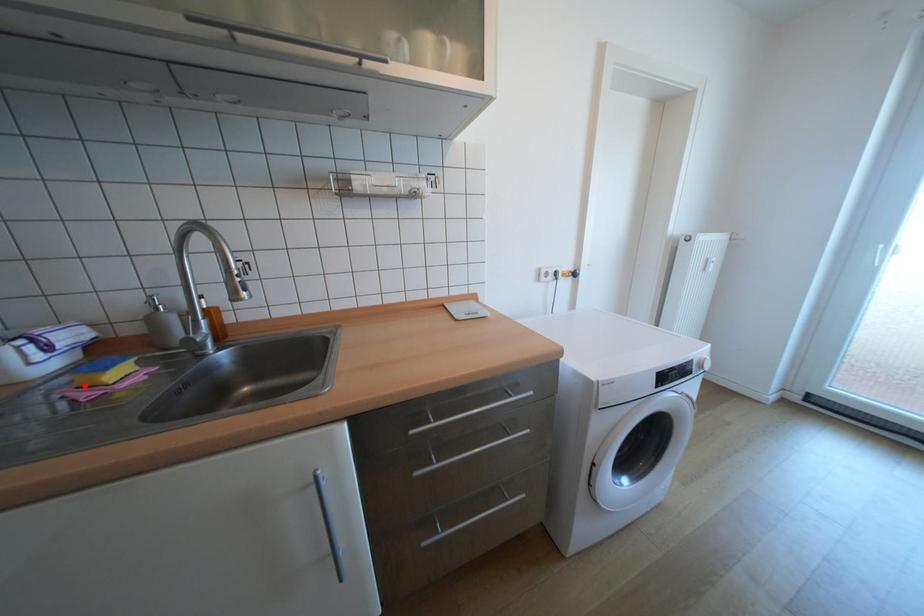
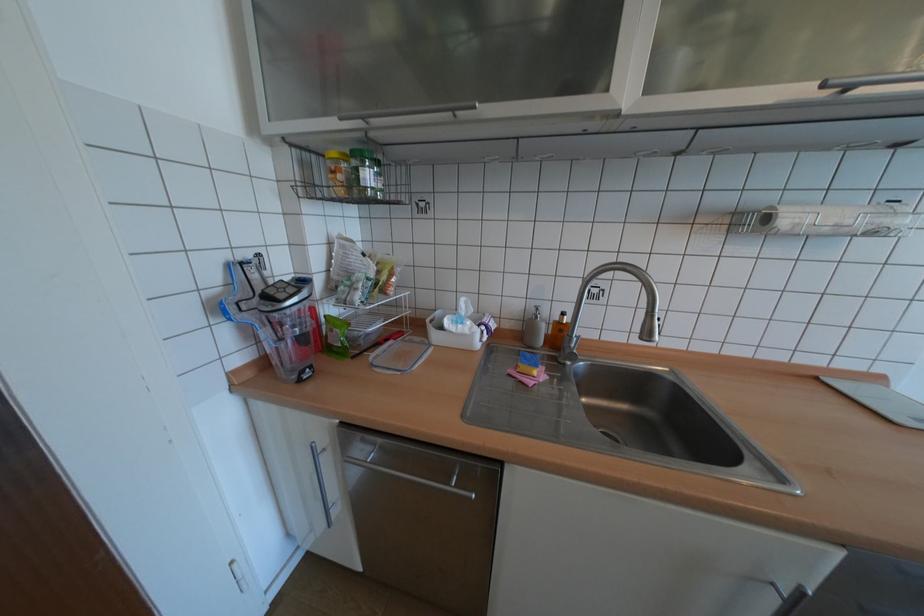
In the second image, find the point that corresponds to the highlighted location in the first image.

(527, 371)